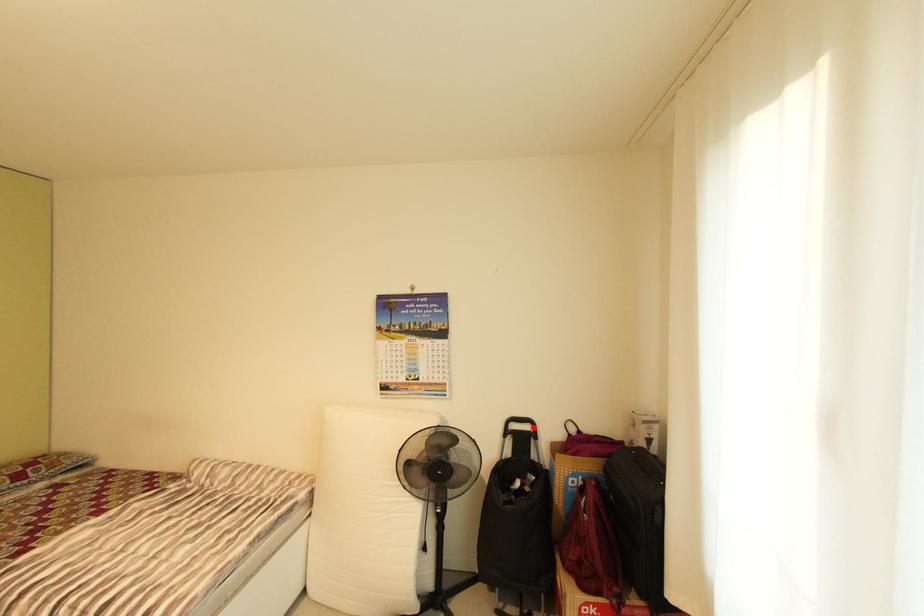
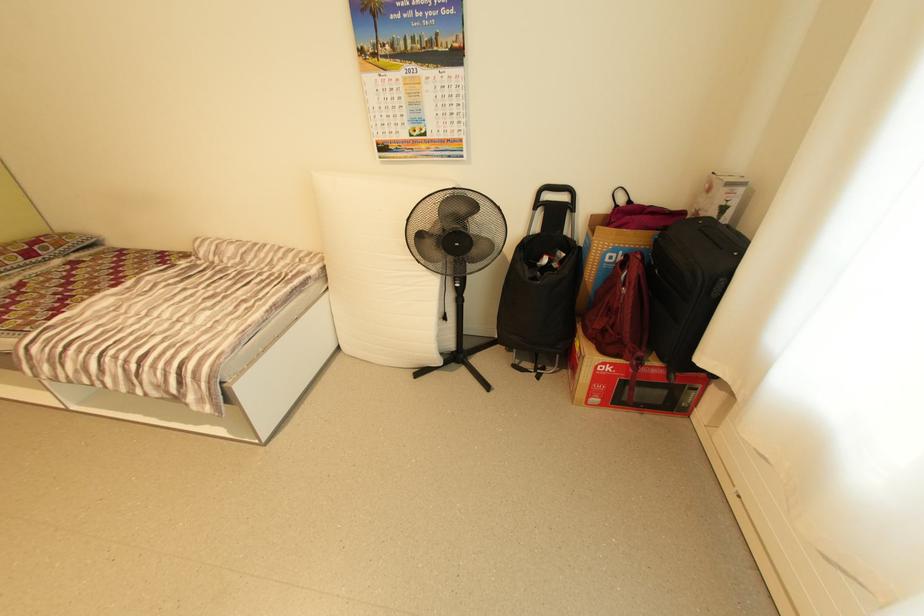
Where in the second image is the point corresponding to the highlighted location from the first image?

(570, 198)